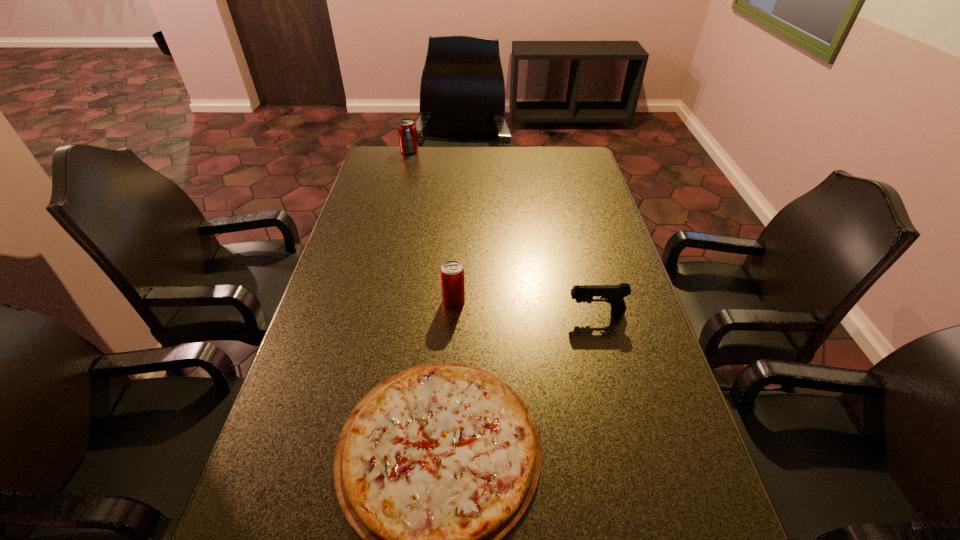
I want to click on pop soda, so click(407, 131).

Where is `can`? This screenshot has width=960, height=540. can is located at coordinates (452, 276).

What are the coordinates of `the rightmost object` in the screenshot? It's located at (614, 294).

The width and height of the screenshot is (960, 540). What are the coordinates of `pistol` in the screenshot? It's located at (614, 294).

At what (x,y) coordinates should I click in order to perform the action: click on blank space located on the front of the pop soda. Please return your answer as a coordinate pair (x, y). The width and height of the screenshot is (960, 540). Looking at the image, I should click on (395, 211).

You are a GUI agent. You are given a task and a screenshot of the screen. Output one action in this format:
    pyautogui.click(x=<x>, y=<y>)
    Task: Click on the blank space located on the back of the second farthest object
    The image size is (960, 540).
    Given the screenshot: What is the action you would take?
    pyautogui.click(x=458, y=224)

The image size is (960, 540). Find the location of `vacant space situated 0.280m at the barrel of the pistol`. vacant space situated 0.280m at the barrel of the pistol is located at coordinates (463, 313).

Where is `vacant region located at the barrel of the pistol`? Image resolution: width=960 pixels, height=540 pixels. vacant region located at the barrel of the pistol is located at coordinates (417, 313).

At what (x,y) coordinates should I click in order to perform the action: click on vacant space located at the barrel of the pistol. Please return your answer as a coordinate pair (x, y). Looking at the image, I should click on (515, 313).

This screenshot has height=540, width=960. What are the coordinates of `object located in the far edge section of the desktop` in the screenshot? It's located at (407, 131).